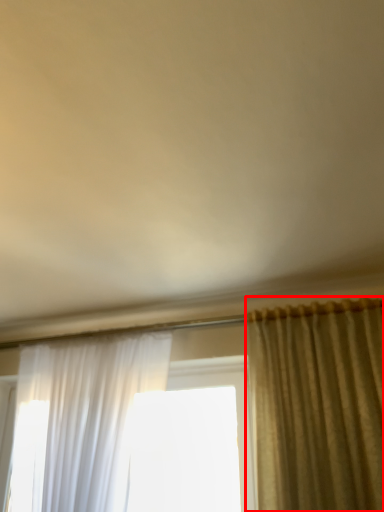
Question: From the image's perspective, considering the relative positions of curtain (annotated by the red box) and curtain in the image provided, where is curtain (annotated by the red box) located with respect to the staircase?

Choices:
 (A) below
 (B) above

Answer: (B)